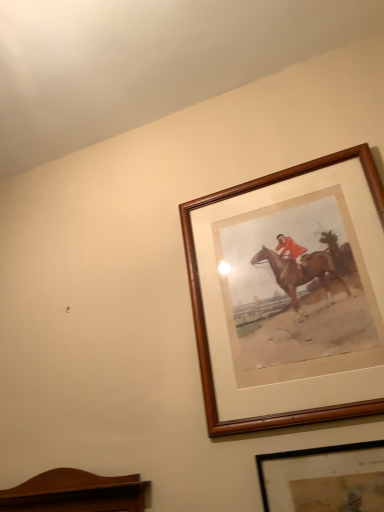
Question: Considering the positions of point (334, 446) and point (205, 197), is point (334, 446) closer or farther from the camera than point (205, 197)?

Choices:
 (A) closer
 (B) farther

Answer: (A)

Question: Is black matte picture frame at lower right, acting as the 2th picture frame starting from the top, in front of or behind wooden picture frame at upper right, positioned as the second picture frame in bottom-to-top order, in the image?

Choices:
 (A) behind
 (B) front

Answer: (B)

Question: Is black matte picture frame at lower right, acting as the 2th picture frame starting from the top, inside the boundaries of wooden picture frame at upper right, which appears as the 1th picture frame when viewed from the top, or outside?

Choices:
 (A) outside
 (B) inside

Answer: (A)

Question: From their relative heights in the image, would you say wooden picture frame at upper right, positioned as the second picture frame in bottom-to-top order, is taller or shorter than black matte picture frame at lower right, positioned as the first picture frame in bottom-to-top order?

Choices:
 (A) tall
 (B) short

Answer: (A)

Question: From the image's perspective, is wooden picture frame at upper right, positioned as the second picture frame in bottom-to-top order, above or below black matte picture frame at lower right, acting as the 2th picture frame starting from the top?

Choices:
 (A) below
 (B) above

Answer: (B)

Question: Is wooden picture frame at upper right, which appears as the 1th picture frame when viewed from the top, wider or thinner than black matte picture frame at lower right, acting as the 2th picture frame starting from the top?

Choices:
 (A) wide
 (B) thin

Answer: (A)

Question: From a real-world perspective, relative to black matte picture frame at lower right, acting as the 2th picture frame starting from the top, is wooden picture frame at upper right, which appears as the 1th picture frame when viewed from the top, vertically above or below?

Choices:
 (A) below
 (B) above

Answer: (B)